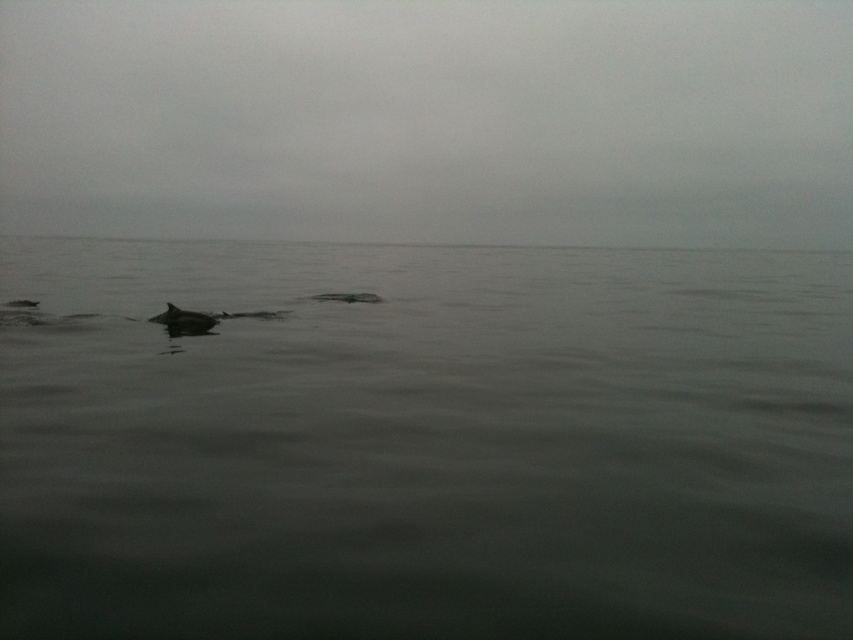
Which is above, gray matte water at center or gray smooth dolphin at center?

Positioned higher is gray matte water at center.

Looking at this image, can you confirm if gray matte water at center is wider than gray smooth dolphin at center?

Yes.

Which is behind, point (264, 301) or point (209, 321)?

Point (264, 301)

What are the coordinates of `gray matte water at center` in the screenshot? It's located at (425, 444).